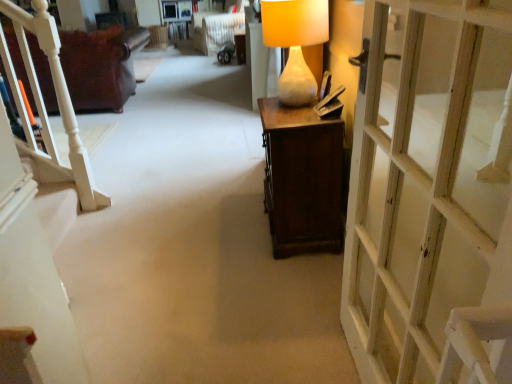
Identify the location of leather couch at left. This screenshot has width=512, height=384. (99, 67).

Find the location of a particular element. The image size is (512, 384). white textured armchair at upper center is located at coordinates (215, 30).

Is white textured armchair at upper center completely or partially outside of matte white vase at center?

Absolutely, white textured armchair at upper center is external to matte white vase at center.

Does white textured armchair at upper center have a lesser width compared to matte white vase at center?

Incorrect, the width of white textured armchair at upper center is not less than that of matte white vase at center.

Is white textured armchair at upper center in front of matte white vase at center?

That is False.

Visually, is white textured armchair at upper center positioned to the left or to the right of matte white vase at center?

From the image, it's evident that white textured armchair at upper center is to the left of matte white vase at center.

From a real-world perspective, which object stands above the other?

In real-world perspective, matte white vase at center is above.

Find the location of `armchair behind the matte white vase at center`. armchair behind the matte white vase at center is located at coordinates (215, 30).

Would you say matte white vase at center is a long distance from white textured armchair at upper center?

matte white vase at center is far away from white textured armchair at upper center.

From the image's perspective, is matte white vase at center under white textured armchair at upper center?

Yes, from the image's perspective, matte white vase at center is below white textured armchair at upper center.

Could you tell me if white textured armchair at upper center is facing white wooden door at right?

No, white textured armchair at upper center is not aimed at white wooden door at right.

Find the location of a particular element. door below the white textured armchair at upper center (from the image's perspective) is located at coordinates (431, 195).

Who is taller, white textured armchair at upper center or white wooden door at right?

With more height is white wooden door at right.

Does white textured armchair at upper center have a larger size compared to white wooden door at right?

Yes, white textured armchair at upper center is bigger than white wooden door at right.

Considering the positions of point (490, 328) and point (302, 25), is point (490, 328) closer or farther from the camera than point (302, 25)?

Clearly, point (490, 328) is closer to the camera than point (302, 25).

From a real-world perspective, is white wooden door at right above or below matte white vase at center?

In terms of real-world spatial position, white wooden door at right is below matte white vase at center.

Is white wooden door at right facing away from matte white vase at center?

No, matte white vase at center is not at the back of white wooden door at right.

Is white wooden door at right far from matte white vase at center?

white wooden door at right is near matte white vase at center, not far away.

What's the angular difference between white wooden door at right and leather couch at left's facing directions?

The facing directions of white wooden door at right and leather couch at left are 90.9 degrees apart.

Is white wooden door at right thinner than leather couch at left?

Yes, white wooden door at right is thinner than leather couch at left.

Considering the relative positions of white wooden door at right and leather couch at left in the image provided, is white wooden door at right to the right of leather couch at left from the viewer's perspective?

Yes.

In the scene shown: Is white wooden door at right touching leather couch at left?

No, white wooden door at right is not beside leather couch at left.

Is leather couch at left to the right of white textured armchair at upper center from the viewer's perspective?

In fact, leather couch at left is to the left of white textured armchair at upper center.

Looking at this image, which object is closer to the camera, leather couch at left or white textured armchair at upper center?

leather couch at left is more forward.

Which of these two, leather couch at left or white textured armchair at upper center, stands taller?

Standing taller between the two is leather couch at left.

From the image's perspective, who appears lower, leather couch at left or white textured armchair at upper center?

leather couch at left is shown below in the image.

Considering the positions of objects leather couch at left and matte white vase at center in the image provided, who is more to the left, leather couch at left or matte white vase at center?

From the viewer's perspective, leather couch at left appears more on the left side.

Considering the relative positions of leather couch at left and matte white vase at center in the image provided, is leather couch at left in front of matte white vase at center?

No.

From a real-world perspective, which object rests below the other?

leather couch at left.

Would you say matte white vase at center is part of leather couch at left's contents?

No, matte white vase at center is not inside leather couch at left.

Locate an element on the screen. This screenshot has height=384, width=512. table lamp below the white textured armchair at upper center (from the image's perspective) is located at coordinates (295, 43).

Where is `armchair below the matte white vase at center (from a real-world perspective)`? The height and width of the screenshot is (384, 512). armchair below the matte white vase at center (from a real-world perspective) is located at coordinates (215, 30).

Based on their spatial positions, is leather couch at left or white wooden door at right closer to white textured armchair at upper center?

The object closer to white textured armchair at upper center is leather couch at left.

Considering their positions, is matte white vase at center positioned further to white wooden door at right than white textured armchair at upper center?

white textured armchair at upper center lies further to white wooden door at right than the other object.

From the image, which object appears to be nearer to white wooden door at right, matte white vase at center or leather couch at left?

Among the two, matte white vase at center is located nearer to white wooden door at right.

In the scene shown: From the image, which object appears to be farther from leather couch at left, white textured armchair at upper center or white wooden door at right?

Based on the image, white wooden door at right appears to be further to leather couch at left.

When comparing their distances from white wooden door at right, does leather couch at left or matte white vase at center seem closer?

Among the two, matte white vase at center is located nearer to white wooden door at right.

Based on their spatial positions, is white textured armchair at upper center or leather couch at left further from matte white vase at center?

white textured armchair at upper center is further to matte white vase at center.

From the image, which object appears to be nearer to white textured armchair at upper center, leather couch at left or matte white vase at center?

Based on the image, leather couch at left appears to be nearer to white textured armchair at upper center.

Considering their positions, is matte white vase at center positioned further to leather couch at left than white textured armchair at upper center?

matte white vase at center.

Find the location of a particular element. Image resolution: width=512 pixels, height=384 pixels. furniture positioned between matte white vase at center and white textured armchair at upper center from near to far is located at coordinates (99, 67).

Identify the location of table lamp between white wooden door at right and white textured armchair at upper center from front to back. (295, 43).

At what (x,y) coordinates should I click in order to perform the action: click on furniture between white wooden door at right and white textured armchair at upper center in the front-back direction. Please return your answer as a coordinate pair (x, y). The height and width of the screenshot is (384, 512). Looking at the image, I should click on (99, 67).

Image resolution: width=512 pixels, height=384 pixels. What are the coordinates of `table lamp between white wooden door at right and leather couch at left in the front-back direction` in the screenshot? It's located at (295, 43).